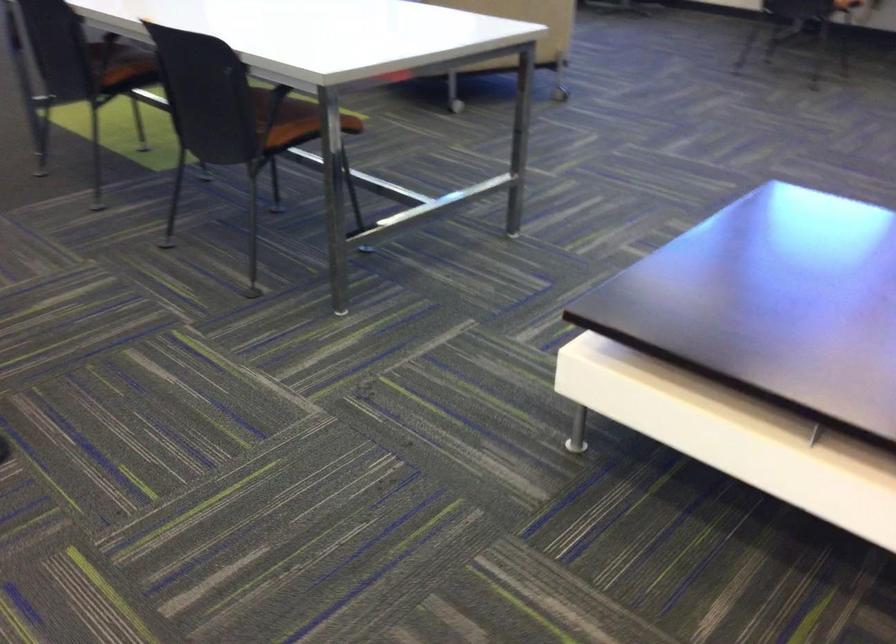
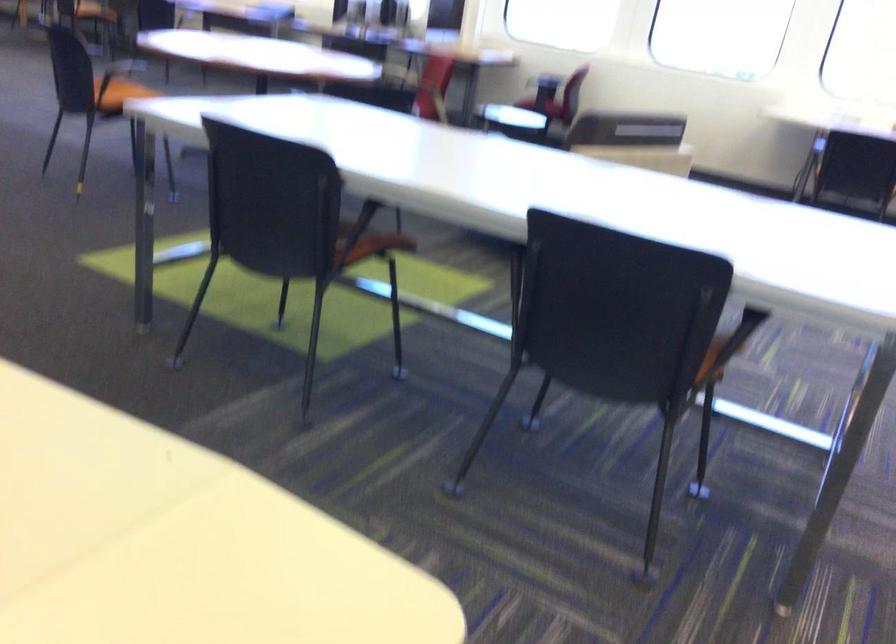
The images are taken continuously from a first-person perspective. In which direction are you moving?

The cameraman walked toward left, forward.